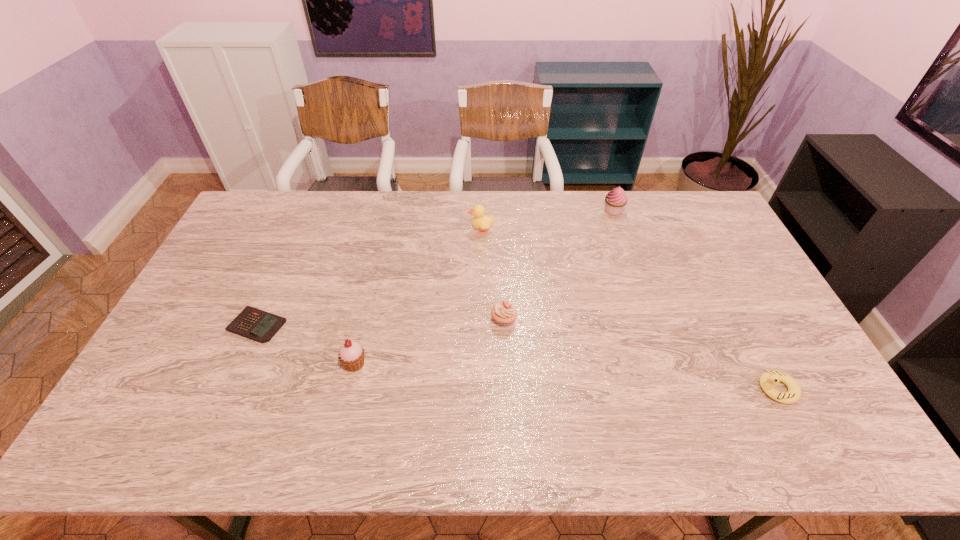
In order to click on blank region between the nearest cupcake and the shortest object in this screenshot , I will do `click(306, 345)`.

Where is `free space between the shorter duckling and the shortest object`? free space between the shorter duckling and the shortest object is located at coordinates (517, 357).

Locate an element on the screen. This screenshot has height=540, width=960. vacant region between the rightmost cupcake and the nearer duckling is located at coordinates (695, 300).

At what (x,y) coordinates should I click in order to perform the action: click on vacant area between the shortest object and the taller duckling. Please return your answer as a coordinate pair (x, y). Image resolution: width=960 pixels, height=540 pixels. Looking at the image, I should click on (370, 278).

Find the location of a particular element. free space between the second cupcake from left to right and the taller duckling is located at coordinates (492, 274).

Where is `empty space that is in between the rightmost object and the second cupcake from left to right`? This screenshot has width=960, height=540. empty space that is in between the rightmost object and the second cupcake from left to right is located at coordinates (640, 354).

This screenshot has height=540, width=960. Find the location of `empty space that is in between the left duckling and the leftmost object`. empty space that is in between the left duckling and the leftmost object is located at coordinates (370, 278).

You are a GUI agent. You are given a task and a screenshot of the screen. Output one action in this format:
    pyautogui.click(x=<x>, y=<y>)
    Task: Click on the free point between the shorter duckling and the shortest object
    This screenshot has width=960, height=540.
    Given the screenshot: What is the action you would take?
    pyautogui.click(x=517, y=357)

Find the location of a particular element. empty space between the farthest object and the second cupcake from left to right is located at coordinates (559, 265).

Locate an element on the screen. Image resolution: width=960 pixels, height=540 pixels. object that is the fifth closest one to the second cupcake from right to left is located at coordinates (769, 379).